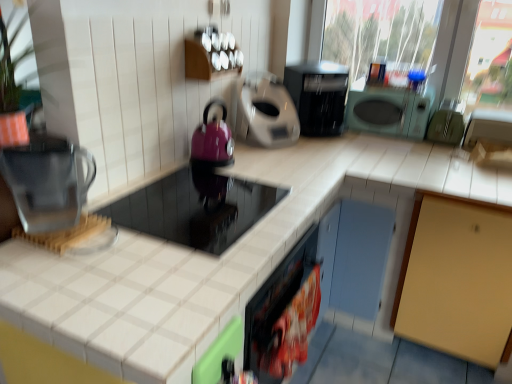
Question: Do you think plastic bag of chips at lower center, which is counted as the 3th appliance, starting from the right, is within shiny black cooktop at center, the first appliance from the left, or outside of it?

Choices:
 (A) inside
 (B) outside

Answer: (B)

Question: From their relative heights in the image, would you say plastic bag of chips at lower center, which is counted as the 3th appliance, starting from the right, is taller or shorter than shiny black cooktop at center, the first appliance from the left?

Choices:
 (A) short
 (B) tall

Answer: (B)

Question: Estimate the real-world distances between objects in this image. Which object is farther from the green rubber gloves at right, marked as the first appliance in a right-to-left arrangement?

Choices:
 (A) matte purple kettle at center-left, the 5th appliance from the right
 (B) green matte microwave at upper right, which is the second appliance in right-to-left order
 (C) white tile countertop at center
 (D) shiny black cooktop at center, the first appliance from the left
 (E) matte gray coffee maker at center, the 4th appliance in the right-to-left sequence

Answer: (D)

Question: Which of these objects is positioned farthest from the transparent plastic water filter at left?

Choices:
 (A) matte gray coffee maker at center, the 4th appliance in the right-to-left sequence
 (B) black plastic toaster at upper center
 (C) green matte microwave at upper right, acting as the fifth appliance starting from the left
 (D) matte purple kettle at center-left, acting as the second appliance starting from the left
 (E) green rubber gloves at right, acting as the sixth appliance starting from the left

Answer: (E)